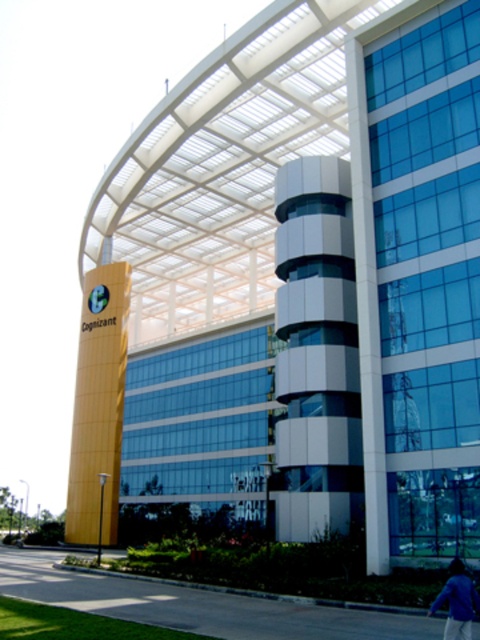
You are standing at the entrance of the modern office building and see the smooth asphalt pavement at lower center and the blue fabric jacket at lower right. Which object is positioned to the left of the other?

The smooth asphalt pavement at lower center is to the left of the blue fabric jacket at lower right.

You are standing at the entrance of the modern office building and see the smooth asphalt pavement at lower center and the blue fabric jacket at lower right. Which object is closer to the ground?

The smooth asphalt pavement at lower center is below the blue fabric jacket at lower right, so it is closer to the ground.